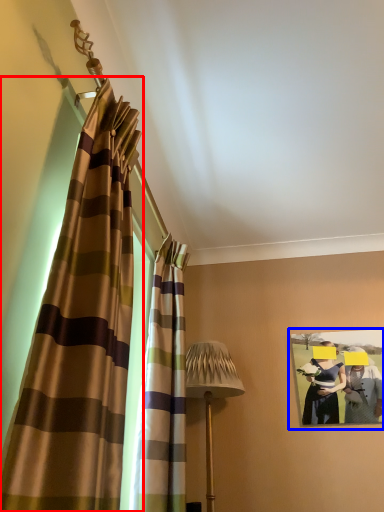
Question: Among these objects, which one is farthest to the camera, curtain (highlighted by a red box) or picture frame (highlighted by a blue box)?

Choices:
 (A) curtain
 (B) picture frame

Answer: (B)